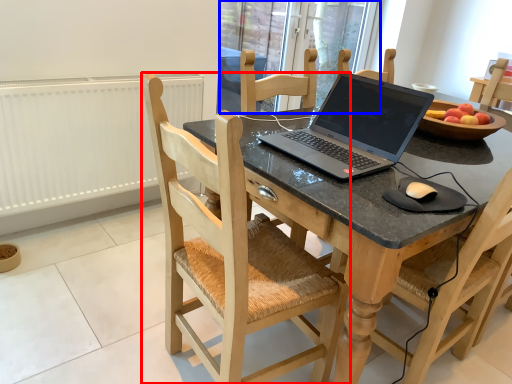
Question: Which object is closer to the camera taking this photo, chair (highlighted by a red box) or glass door (highlighted by a blue box)?

Choices:
 (A) chair
 (B) glass door

Answer: (A)